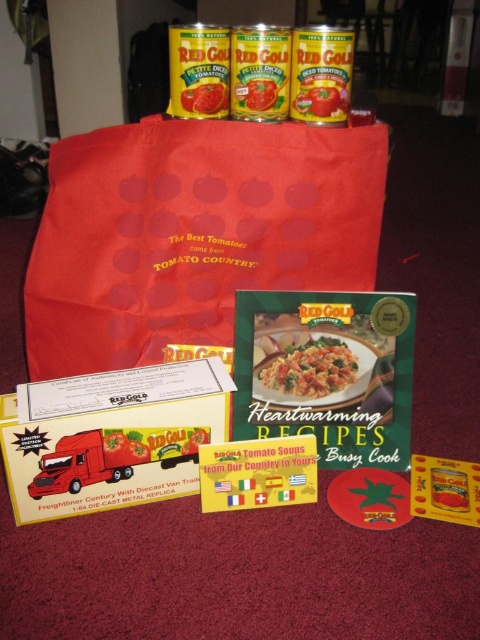
You are organizing a pantry and need to stack items vertically. You have a red matte paper bag at upper center and a tomato paste can at upper center. Which item should you place at the bottom to ensure stability?

The red matte paper bag at upper center has a greater height compared to the tomato paste can at upper center. To ensure stability when stacking, place the taller item, the red matte paper bag at upper center, at the bottom since it has a larger base.

You are organizing a kitchen pantry and need to place the red matte paper bag at upper center and the matte green book at center on a shelf. The shelf has limited space. Which item should you place first to maximize shelf space efficiency?

The red matte paper bag at upper center is larger in size than the matte green book at center, so you should place the red matte paper bag at upper center first to make better use of the shelf space.